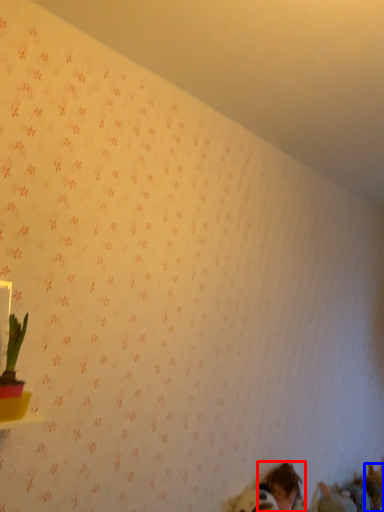
Question: Which object appears closest to the camera in this image, person (highlighted by a red box) or animal (highlighted by a blue box)?

Choices:
 (A) person
 (B) animal

Answer: (A)